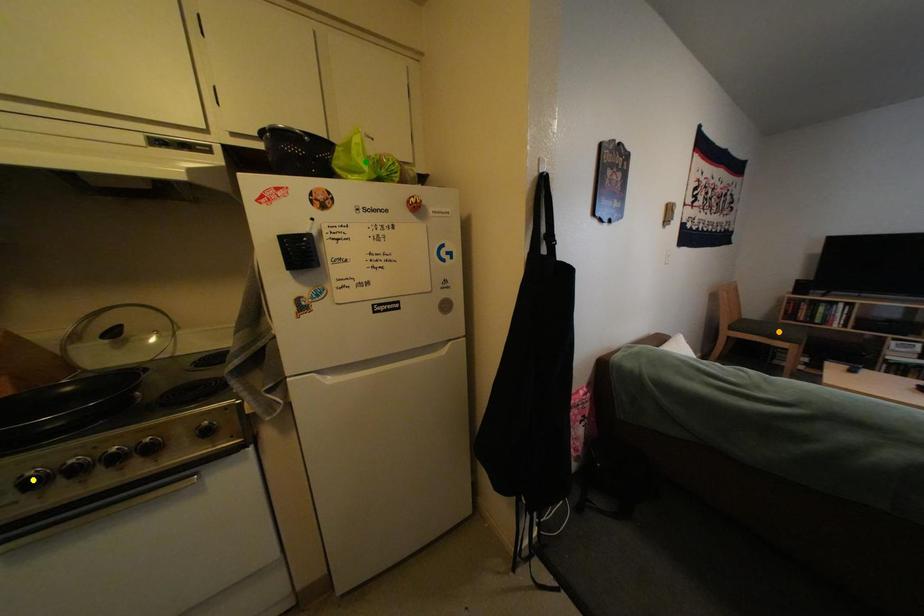
Order these from farthest to nearest:
A) green point
B) orange point
C) yellow point

1. orange point
2. green point
3. yellow point